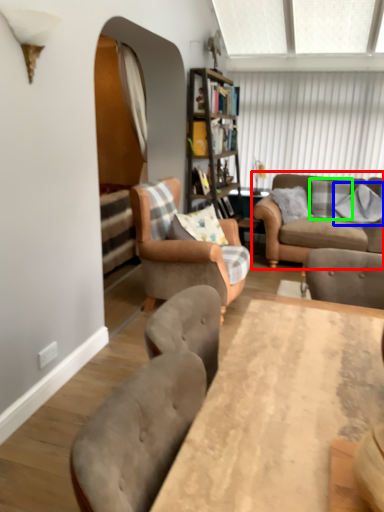
Question: Which object is positioned farthest from studio couch (highlighted by a red box)? Select from pillow (highlighted by a blue box) and pillow (highlighted by a green box).

Choices:
 (A) pillow
 (B) pillow

Answer: (A)